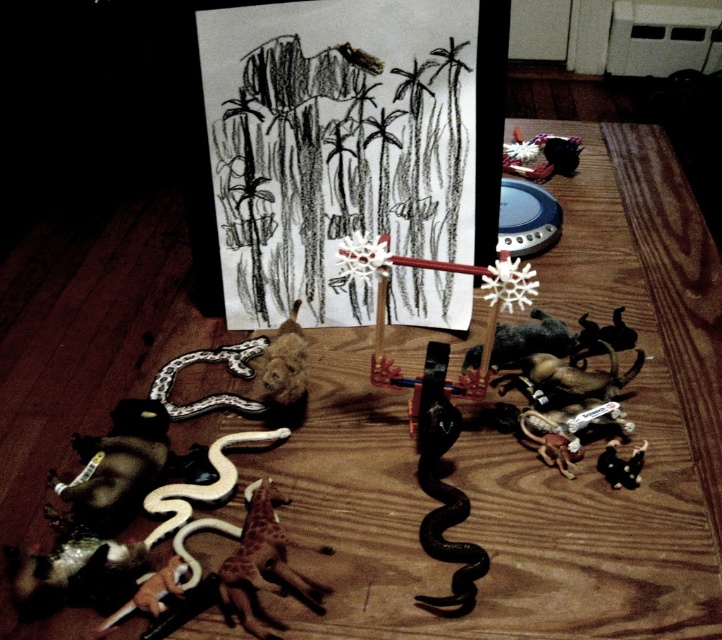
Question: Is black rubber snake at center bigger than speckled plastic snake at lower left?

Choices:
 (A) no
 (B) yes

Answer: (B)

Question: Is black rubber snake at center below speckled plastic snake at lower left?

Choices:
 (A) no
 (B) yes

Answer: (B)

Question: Which of the following is the farthest from the observer?

Choices:
 (A) black rubber snake at center
 (B) speckled plastic snake at lower left

Answer: (B)

Question: Which point appears farthest from the camera in this image?

Choices:
 (A) (200, 412)
 (B) (466, 502)

Answer: (A)

Question: From the image, what is the correct spatial relationship of black rubber snake at center in relation to speckled plastic snake at lower left?

Choices:
 (A) right
 (B) left

Answer: (A)

Question: Which point appears farthest from the camera in this image?

Choices:
 (A) (209, 353)
 (B) (469, 609)

Answer: (A)